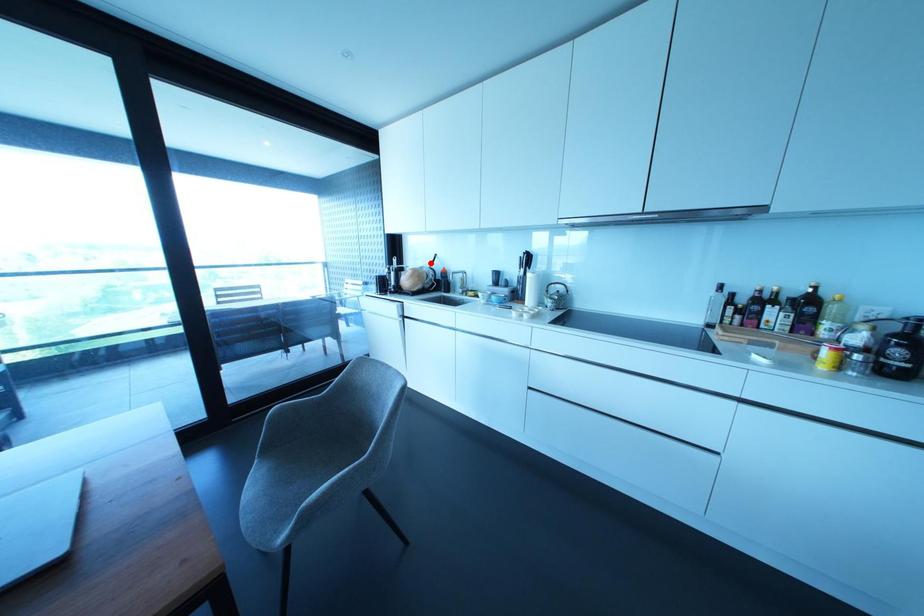
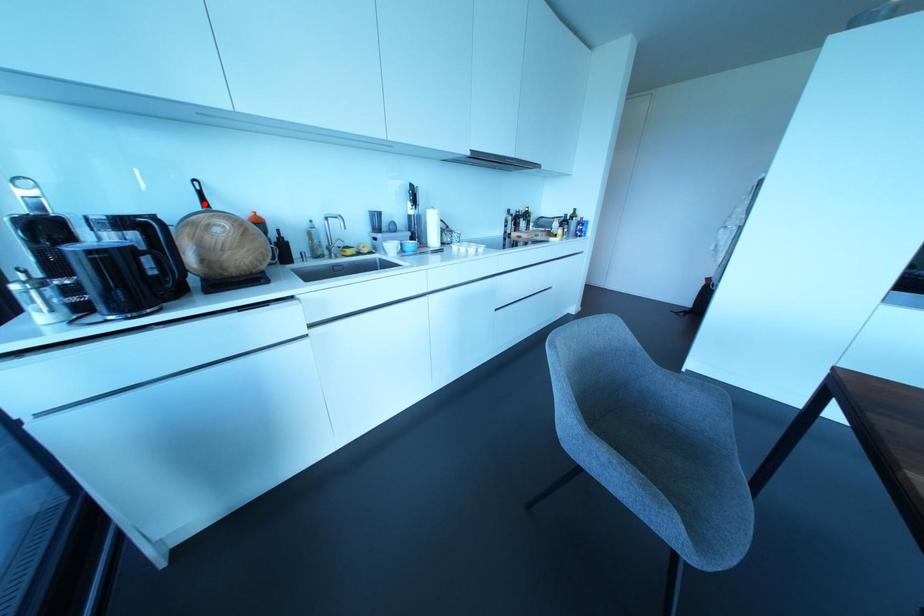
I am providing you with two images of the same scene from different viewpoints. A red point is marked on the first image and another point is marked on the second image. Are the points marked in image1 and image2 representing the same 3D position?

Yes